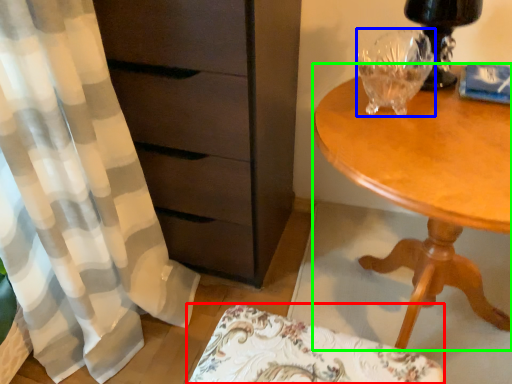
Question: Which object is positioned closest to swivel chair (highlighted by a red box)? Select from glass vase (highlighted by a blue box) and desk (highlighted by a green box).

Choices:
 (A) glass vase
 (B) desk

Answer: (B)